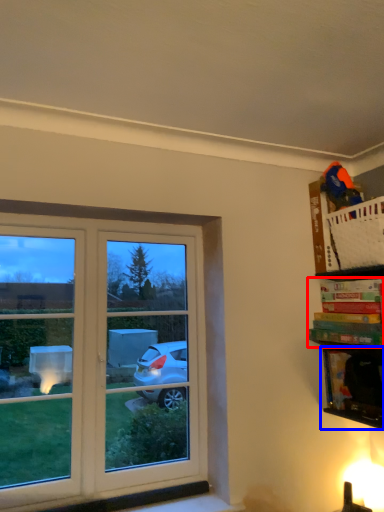
Question: Which object is closer to the camera taking this photo, book (highlighted by a red box) or cabinet (highlighted by a blue box)?

Choices:
 (A) book
 (B) cabinet

Answer: (A)